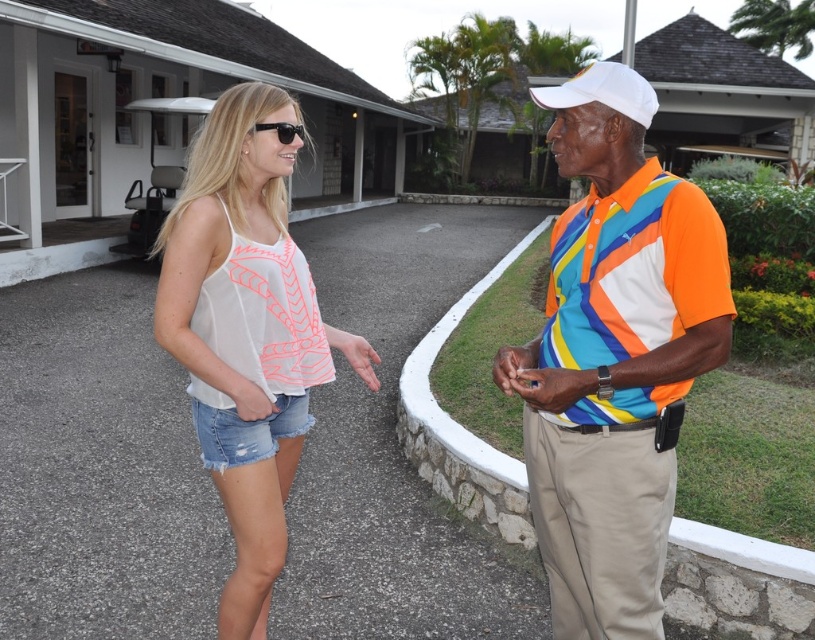
You are a photographer trying to capture a candid shot of the two people in the scene. You notice the multicolored jersey at center and the black plastic sunglasses at upper center. Which object is positioned higher in the image?

The black plastic sunglasses at upper center are positioned higher in the image than the multicolored jersey at center.

You are designing a storage system for a small closet. You have two items to store here, the white denim shorts at lower left and the orange polyester safety vest at right. The shelf you are using has a maximum width capacity of 40 cm. According to the objects description, can both items be placed on the same shelf without exceeding the width limit?

The white denim shorts at lower left has a larger width than the orange polyester safety vest at right. Since the shelf can only hold up to 40 cm, and the shorts are wider than the vest, but we don know the exact width of either item. Therefore, it is uncertain if both can fit together without exceeding the limit.

You are a security guard in the resort area. You need to check if the white denim shorts at lower left is located below the orange polyester safety vest at right. According to the scene, is this true?

Yes, the white denim shorts at lower left is positioned under orange polyester safety vest at right as described in the scene.